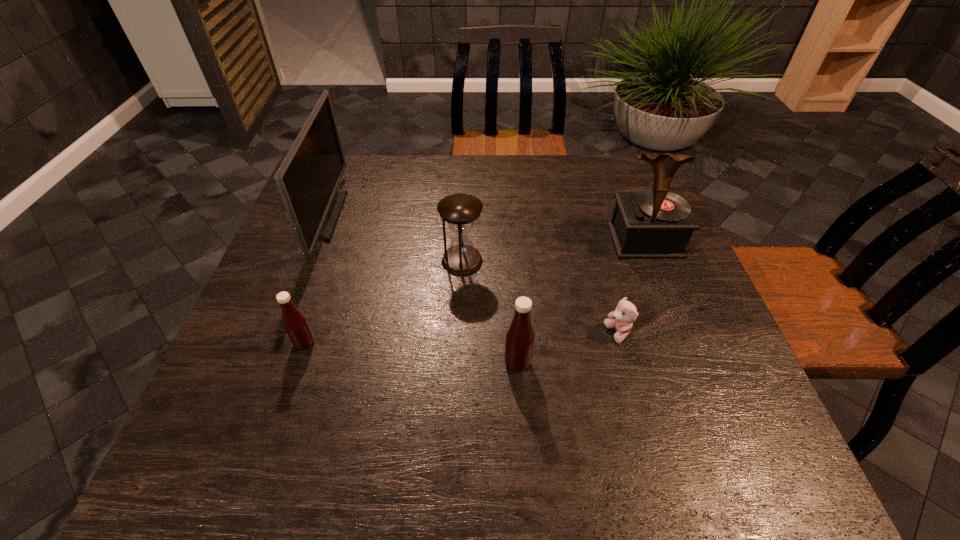
The height and width of the screenshot is (540, 960). Find the location of `free spot between the shorter Tabasco sauce and the monitor`. free spot between the shorter Tabasco sauce and the monitor is located at coordinates (315, 280).

What are the coordinates of `vacant area between the monitor and the shorter Tabasco sauce` in the screenshot? It's located at (315, 280).

Locate an element on the screen. Image resolution: width=960 pixels, height=540 pixels. free space between the left Tabasco sauce and the phonograph_record is located at coordinates (474, 292).

The height and width of the screenshot is (540, 960). Find the location of `free area in between the hourglass and the farther Tabasco sauce`. free area in between the hourglass and the farther Tabasco sauce is located at coordinates (383, 302).

The width and height of the screenshot is (960, 540). I want to click on unoccupied area between the third object from left to right and the phonograph_record, so click(553, 251).

Identify the location of vacant point located between the fourth object from right to left and the rightmost object. (553, 251).

Locate an element on the screen. The height and width of the screenshot is (540, 960). free point between the hourglass and the farther Tabasco sauce is located at coordinates (383, 302).

Where is `vacant space that's between the hourglass and the rightmost object`? The height and width of the screenshot is (540, 960). vacant space that's between the hourglass and the rightmost object is located at coordinates (553, 251).

Where is `vacant area between the monitor and the nearer Tabasco sauce`? The height and width of the screenshot is (540, 960). vacant area between the monitor and the nearer Tabasco sauce is located at coordinates (420, 289).

Identify the location of the fourth closest object relative to the hourglass. The image size is (960, 540). (294, 322).